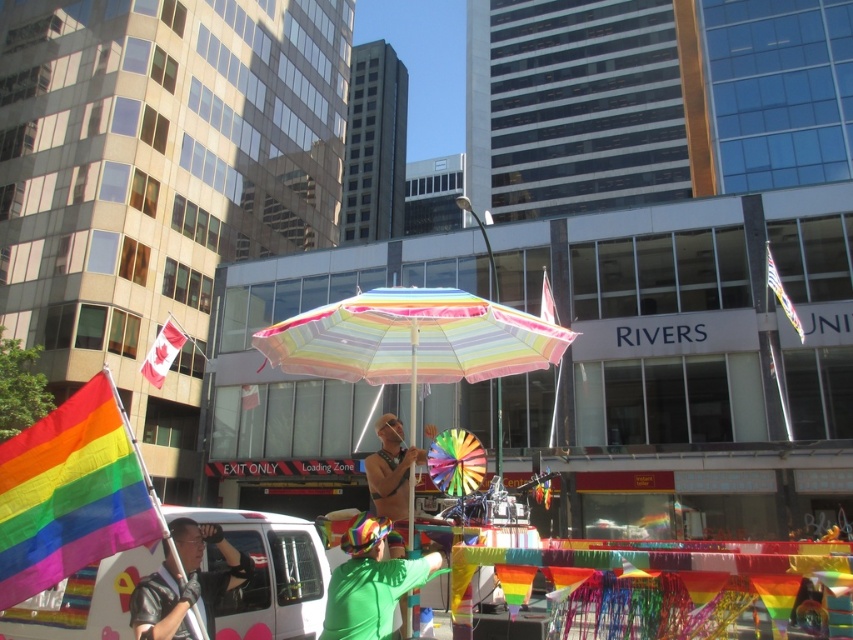
What do you see at coordinates (268, 573) in the screenshot?
I see `white matte van at center` at bounding box center [268, 573].

Looking at this image, which of these two, white matte van at center or leather jacket at lower left, stands shorter?

leather jacket at lower left is shorter.

Image resolution: width=853 pixels, height=640 pixels. I want to click on white matte van at center, so click(268, 573).

You are a GUI agent. You are given a task and a screenshot of the screen. Output one action in this format:
    pyautogui.click(x=<x>, y=<y>)
    Task: Click on the white matte van at center
    The image size is (853, 640).
    Given the screenshot: What is the action you would take?
    pyautogui.click(x=268, y=573)

Where is `rainbow fabric flag at lower left`? rainbow fabric flag at lower left is located at coordinates (73, 492).

Is green matte umbrella at center above red fabric flag at upper left?

Actually, green matte umbrella at center is below red fabric flag at upper left.

Which is below, green matte umbrella at center or red fabric flag at upper left?

Positioned lower is green matte umbrella at center.

Does point (347, 586) come closer to viewer compared to point (161, 362)?

Yes, point (347, 586) is closer to viewer.

At what (x,y) coordinates should I click in order to perform the action: click on green matte umbrella at center. Please return your answer as a coordinate pair (x, y). The image size is (853, 640). Looking at the image, I should click on (370, 580).